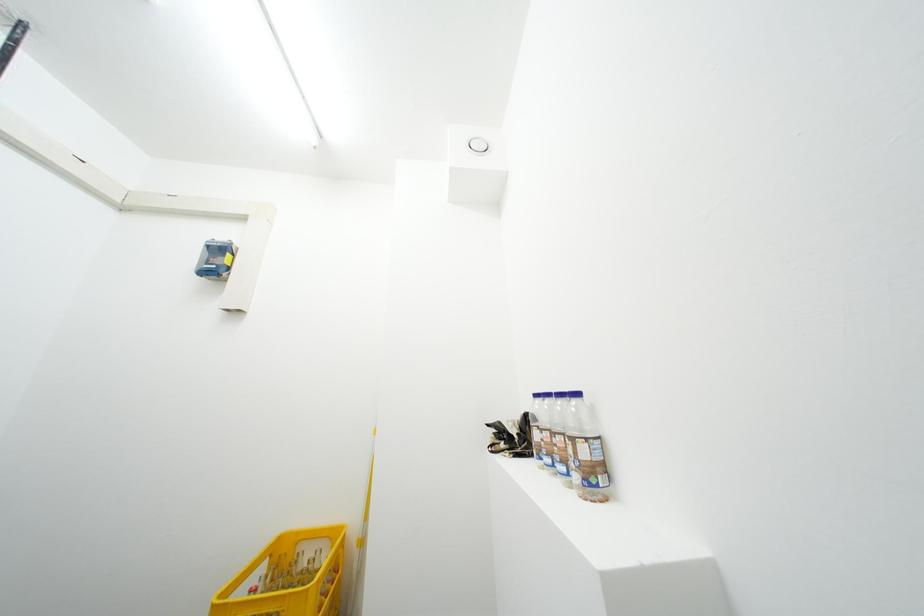
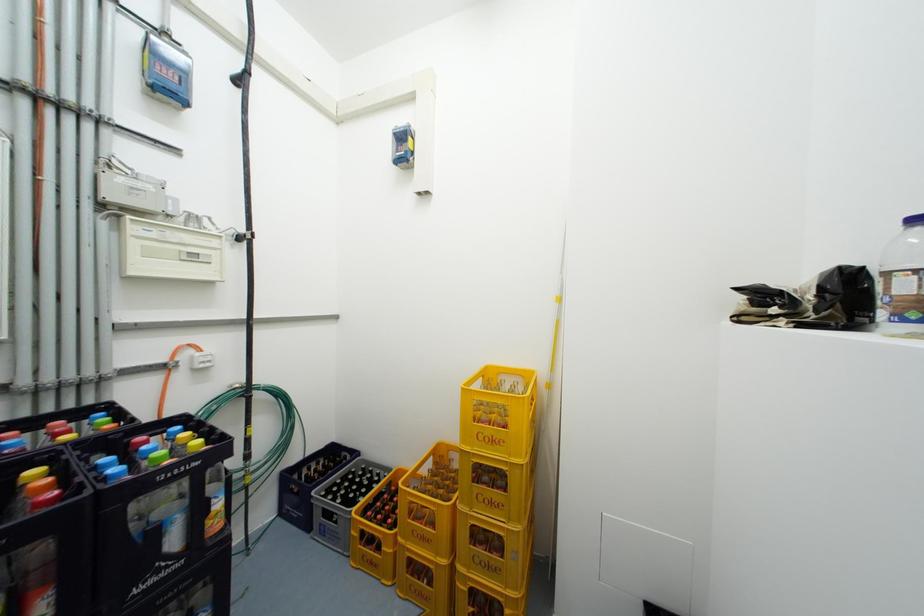
The first image is from the beginning of the video and the second image is from the end. How did the camera likely rotate when shooting the video?

The camera's rotation is toward left-down.